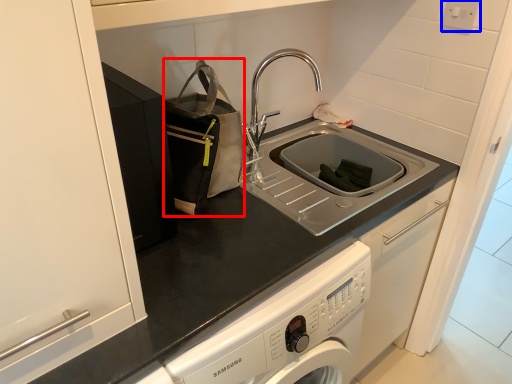
Question: Which object is closer to the camera taking this photo, bag (highlighted by a red box) or electric outlet (highlighted by a blue box)?

Choices:
 (A) bag
 (B) electric outlet

Answer: (A)